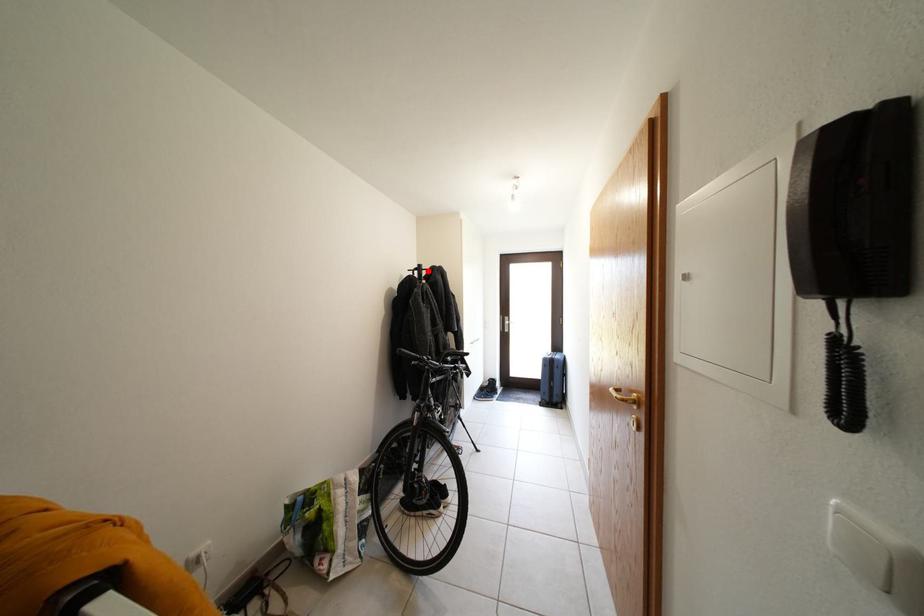
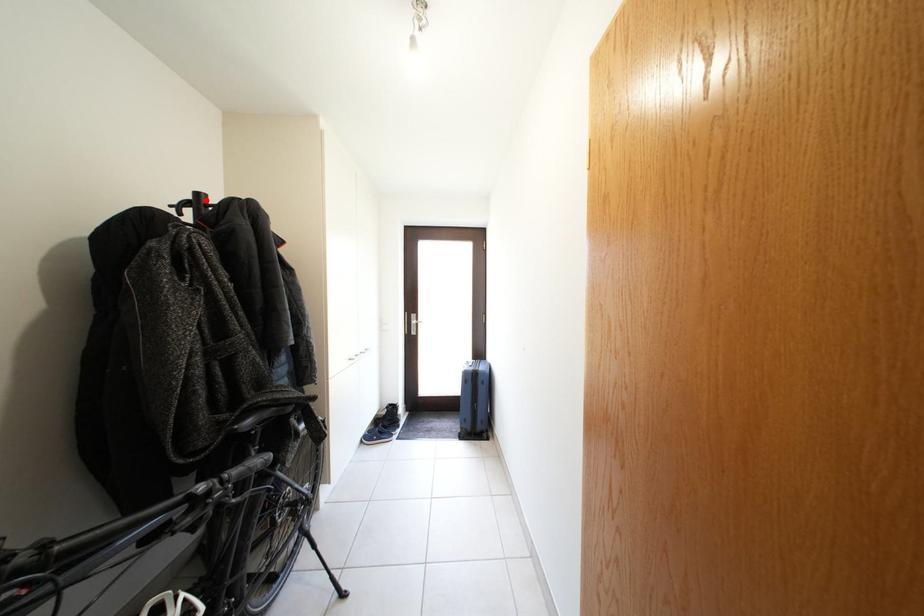
I am providing you with two images of the same scene from different viewpoints. A red point is marked on the first image and another point is marked on the second image. Are the points marked in image1 and image2 representing the same 3D position?

Yes